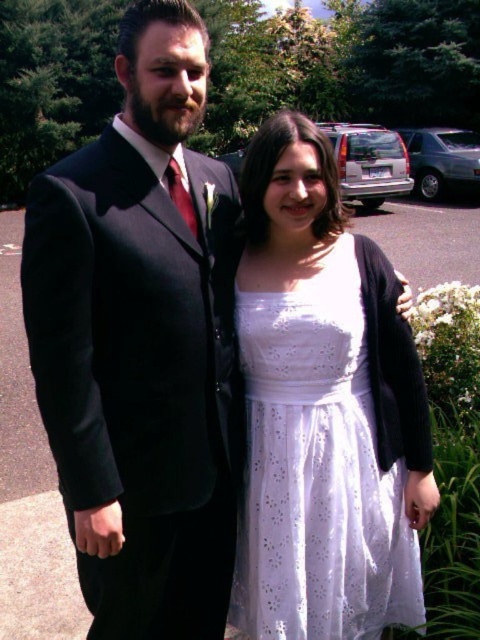
You are a photographer setting up for an outdoor event. You notice the dark gray wool suit at left and the white lace dress at center in your frame. Which object is closer to the camera based on their positions?

The dark gray wool suit at left is closer to the camera since it is in front of the white lace dress at center.

You are a photographer trying to capture a candid shot of both the dark gray wool suit at left and the white lace dress at center. Since you want to ensure both are in focus, which part of the scene should you focus on first?

The dark gray wool suit at left is above the white lace dress at center, so focusing on the dark gray wool suit at left first will ensure both are in focus as the white lace dress at center is closer to the camera.

In the scene shown: You are standing at the point marked as point (177, 518) and want to take a photo of the two people in the scene. The camera you have requires you to be at least 2 meters away from the subject to avoid distortion. Can you take the photo without moving from your current position?

The distance between point (177, 518) and the camera is 1.78 meters. Since this is less than the required 2 meters, you cannot take the photo without moving closer or adjusting your position to meet the distance requirement.